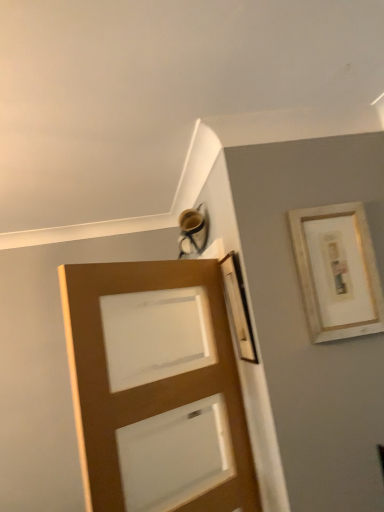
Question: Relative to gold-framed artwork at upper right, is brown matte door at center in front or behind?

Choices:
 (A) behind
 (B) front

Answer: (B)

Question: Is brown matte door at center wider or thinner than gold-framed artwork at upper right?

Choices:
 (A) wide
 (B) thin

Answer: (A)

Question: Considering the positions of brown matte door at center and gold-framed artwork at upper right in the image, is brown matte door at center taller or shorter than gold-framed artwork at upper right?

Choices:
 (A) tall
 (B) short

Answer: (A)

Question: Visually, is gold-framed artwork at upper right positioned to the left or to the right of brown matte door at center?

Choices:
 (A) right
 (B) left

Answer: (A)

Question: Is gold-framed artwork at upper right inside or outside of brown matte door at center?

Choices:
 (A) inside
 (B) outside

Answer: (B)

Question: Considering their positions, is gold-framed artwork at upper right located in front of or behind brown matte door at center?

Choices:
 (A) behind
 (B) front

Answer: (A)

Question: From the image's perspective, relative to brown matte door at center, is gold-framed artwork at upper right above or below?

Choices:
 (A) below
 (B) above

Answer: (B)